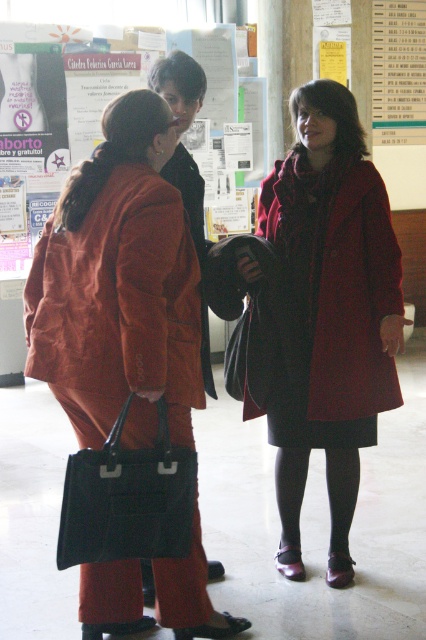
You are an interior designer assessing the layout of this room. You notice the matte orange suit at center and the matte black poster at upper center. Which object takes up more visual space in the scene?

The matte black poster at upper center takes up more visual space than the matte orange suit at center.

You are organizing a photo shoot and need to ensure proper lighting. The matte red coat at center and the white paper at upper right must be visible. Based on their positions, which object is closer to the top of the image?

The white paper at upper right is closer to the top of the image because it is positioned above the matte red coat at center.

You are organizing a charity event and need to place a donation box. The donation box requires a surface that is larger than the matte red coat at center. Can the white paper at upper right provide a suitable surface for the donation box?

The matte red coat at center has a smaller size compared to white paper at upper right, so the white paper at upper right is large enough to accommodate the donation box.